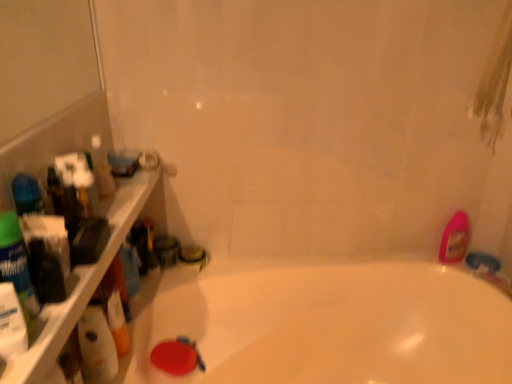
Question: Does pink glossy bottle at right have a greater height compared to translucent plastic bottles at left?

Choices:
 (A) no
 (B) yes

Answer: (B)

Question: From the image's perspective, is pink glossy bottle at right above translucent plastic bottles at left?

Choices:
 (A) no
 (B) yes

Answer: (A)

Question: Does pink glossy bottle at right have a lesser width compared to translucent plastic bottles at left?

Choices:
 (A) yes
 (B) no

Answer: (A)

Question: Does pink glossy bottle at right appear on the right side of translucent plastic bottles at left?

Choices:
 (A) no
 (B) yes

Answer: (B)

Question: Is translucent plastic bottles at left inside pink glossy bottle at right?

Choices:
 (A) yes
 (B) no

Answer: (B)

Question: Can you confirm if pink glossy bottle at right is wider than translucent plastic bottles at left?

Choices:
 (A) yes
 (B) no

Answer: (B)

Question: From the image's perspective, is white glossy bathtub at center over pink glossy bottle at right?

Choices:
 (A) yes
 (B) no

Answer: (B)

Question: From the image's perspective, is white glossy bathtub at center beneath pink glossy bottle at right?

Choices:
 (A) yes
 (B) no

Answer: (A)

Question: From a real-world perspective, is white glossy bathtub at center over pink glossy bottle at right?

Choices:
 (A) no
 (B) yes

Answer: (A)

Question: Can you confirm if white glossy bathtub at center is shorter than pink glossy bottle at right?

Choices:
 (A) no
 (B) yes

Answer: (A)

Question: Is the depth of white glossy bathtub at center greater than that of pink glossy bottle at right?

Choices:
 (A) yes
 (B) no

Answer: (B)

Question: Are white glossy bathtub at center and pink glossy bottle at right beside each other?

Choices:
 (A) yes
 (B) no

Answer: (B)

Question: Is white glossy bottle at left bigger than translucent plastic bottles at left?

Choices:
 (A) no
 (B) yes

Answer: (A)